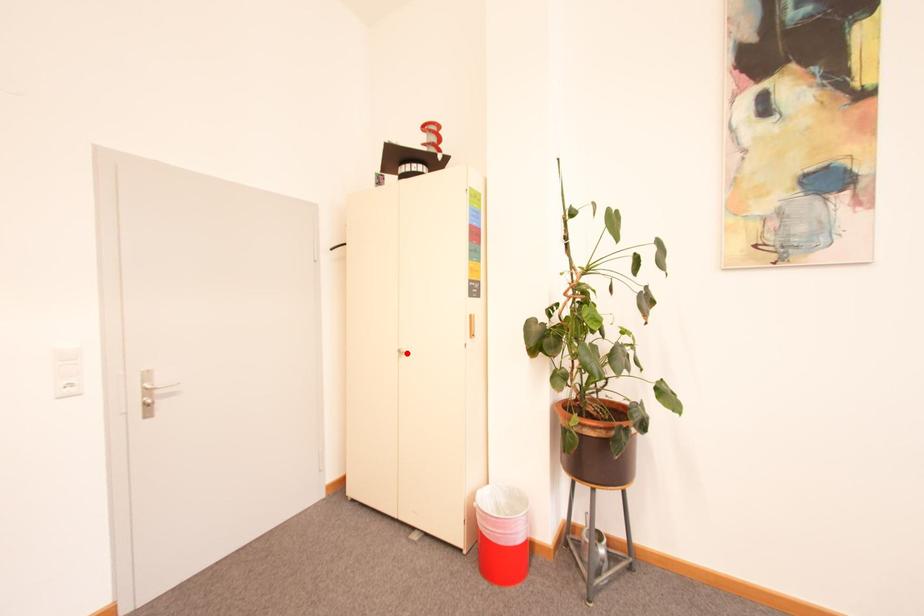
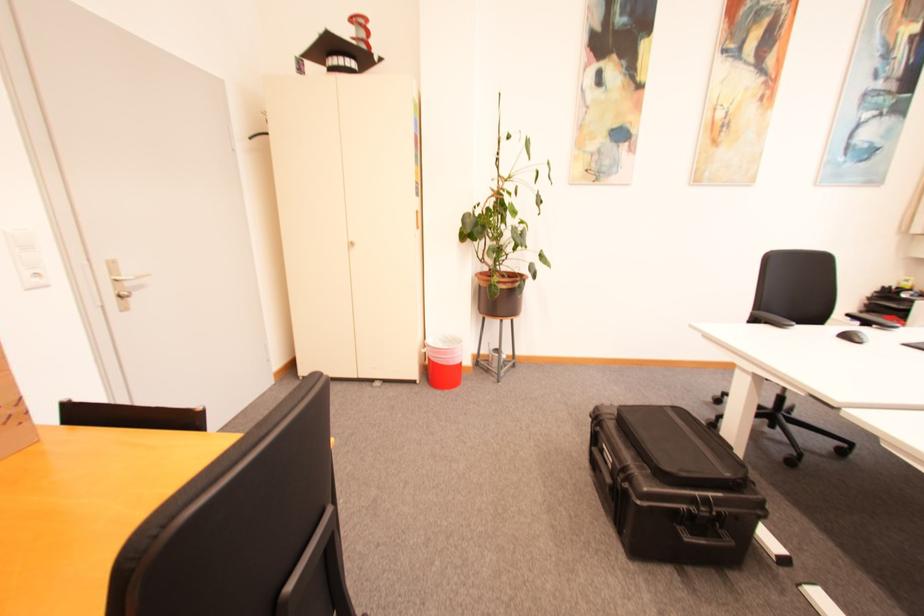
The point at the highlighted location is marked in the first image. Where is the corresponding point in the second image?

(359, 245)